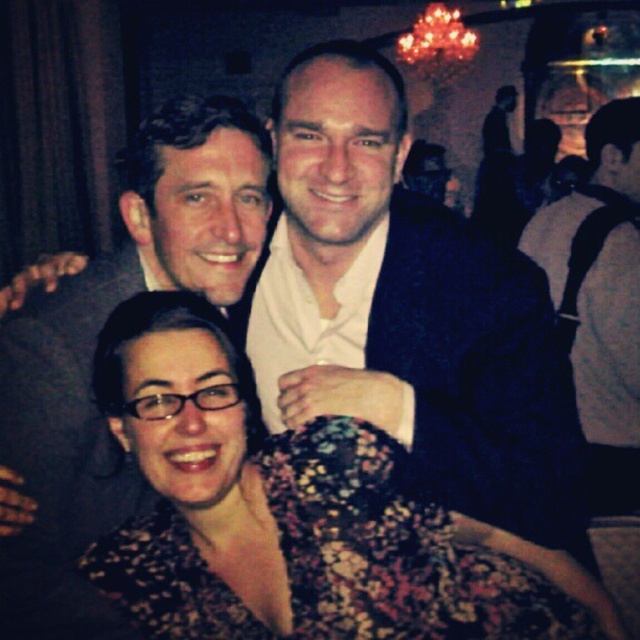
Question: Which point is closer to the camera?

Choices:
 (A) (218, 400)
 (B) (609, 444)

Answer: (A)

Question: Observing the image, what is the correct spatial positioning of floral dress at center in reference to white sweater at right?

Choices:
 (A) left
 (B) right

Answer: (A)

Question: Does floral dress at center appear on the right side of white sweater at right?

Choices:
 (A) yes
 (B) no

Answer: (B)

Question: Where is floral dress at center located in relation to white sweater at right in the image?

Choices:
 (A) right
 (B) left

Answer: (B)

Question: Which point is closer to the camera?

Choices:
 (A) floral dress at center
 (B) white sweater at right

Answer: (A)